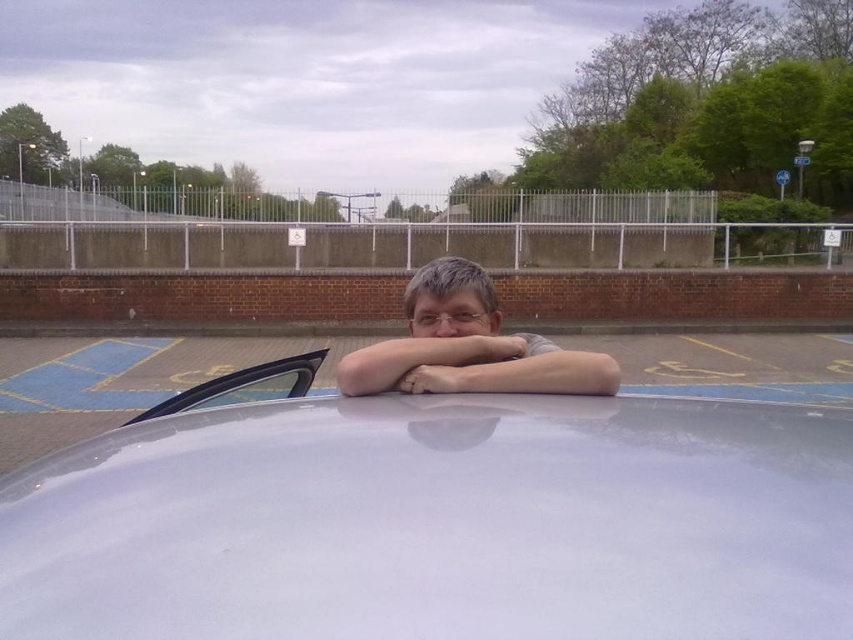
You are a delivery person trying to place a package between the white glossy car at center and the brick wall behind it. The package is 60 centimeters long. Can you fit the package horizontally between them?

The distance between the white glossy car at center and the brick wall is 57.50 centimeters, so the package cannot be placed horizontally as it is longer than the available space.

You are a delivery person with a box that is 1.5 meters long. You need to place the box on the ground between the white glossy car at center and the transparent glass windshield at upper left. Is there enough space for the box to fit horizontally between them?

The white glossy car at center and transparent glass windshield at upper left are 1.28 meters apart. Since the box is 1.5 meters long, it is longer than the available space between them. Therefore, the box cannot fit horizontally between the white glossy car at center and the transparent glass windshield at upper left.

You are a photographer trying to capture the scene of a person leaning over a car hood. You notice the matte gray shirt at center and the transparent glass windshield at upper left. Which object in the scene would appear bigger in your photo?

The matte gray shirt at center would appear bigger in the photo because it has a larger size compared to the transparent glass windshield at upper left.